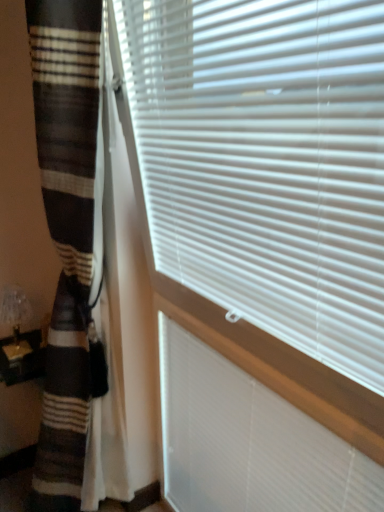
Question: Is striped wool blanket at left next to white plastic blinds at center and touching it?

Choices:
 (A) yes
 (B) no

Answer: (B)

Question: Does striped wool blanket at left appear on the right side of white plastic blinds at center?

Choices:
 (A) yes
 (B) no

Answer: (B)

Question: Does striped wool blanket at left come in front of white plastic blinds at center?

Choices:
 (A) yes
 (B) no

Answer: (A)

Question: Considering the relative sizes of striped wool blanket at left and white plastic blinds at center in the image provided, is striped wool blanket at left wider than white plastic blinds at center?

Choices:
 (A) yes
 (B) no

Answer: (A)

Question: Does striped wool blanket at left have a lesser width compared to white plastic blinds at center?

Choices:
 (A) no
 (B) yes

Answer: (A)

Question: Is striped wool blanket at left smaller than white plastic blinds at center?

Choices:
 (A) yes
 (B) no

Answer: (B)

Question: Is white plastic blinds at center directly adjacent to striped wool blanket at left?

Choices:
 (A) no
 (B) yes

Answer: (A)

Question: Is white plastic blinds at center closer to camera compared to striped wool blanket at left?

Choices:
 (A) yes
 (B) no

Answer: (B)

Question: Is white plastic blinds at center far from striped wool blanket at left?

Choices:
 (A) no
 (B) yes

Answer: (A)

Question: From a real-world perspective, is white plastic blinds at center over striped wool blanket at left?

Choices:
 (A) yes
 (B) no

Answer: (B)

Question: Does white plastic blinds at center contain striped wool blanket at left?

Choices:
 (A) no
 (B) yes

Answer: (A)

Question: Is white plastic blinds at center to the left of striped wool blanket at left from the viewer's perspective?

Choices:
 (A) no
 (B) yes

Answer: (A)

Question: From the image's perspective, is translucent glass table lamp at lower left below striped wool blanket at left?

Choices:
 (A) no
 (B) yes

Answer: (A)